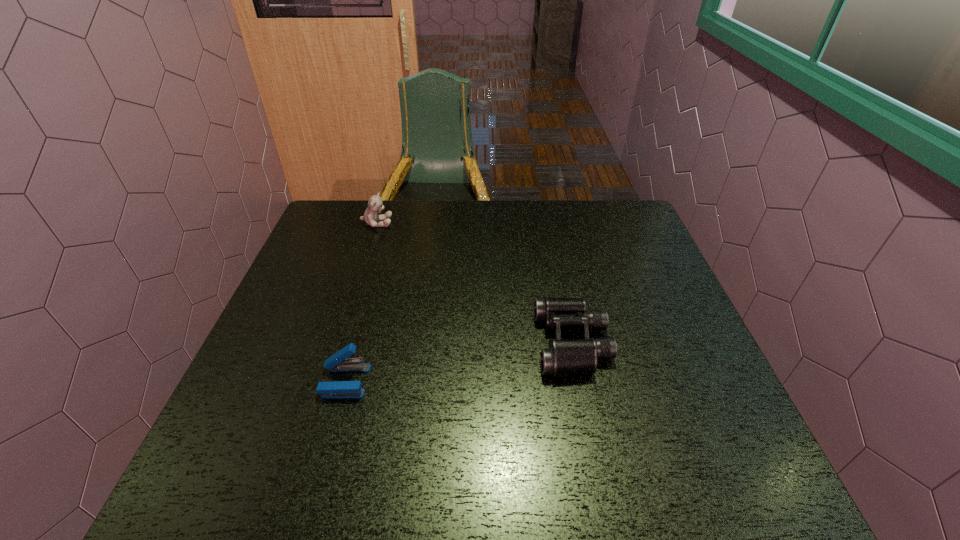
Locate an element on the screen. teddy bear is located at coordinates (375, 204).

Locate an element on the screen. This screenshot has height=540, width=960. binoculars is located at coordinates (563, 356).

Identify the location of stapler. (337, 362).

Identify the location of free region located 0.220m on the face of the farthest object. This screenshot has height=540, width=960. (461, 223).

Find the location of a particular element. This screenshot has height=540, width=960. vacant space situated on the front-facing side of the binoculars is located at coordinates (431, 342).

I want to click on free spot located 0.050m on the front-facing side of the binoculars, so (x=516, y=342).

Where is `free space located on the front-facing side of the binoculars`? This screenshot has height=540, width=960. free space located on the front-facing side of the binoculars is located at coordinates (482, 342).

In order to click on free spot located 0.050m on the right of the stapler in this screenshot , I will do `click(391, 381)`.

Where is `object located at the far edge`? This screenshot has width=960, height=540. object located at the far edge is located at coordinates (375, 204).

This screenshot has width=960, height=540. In order to click on object that is at the left edge in this screenshot , I will do `click(375, 204)`.